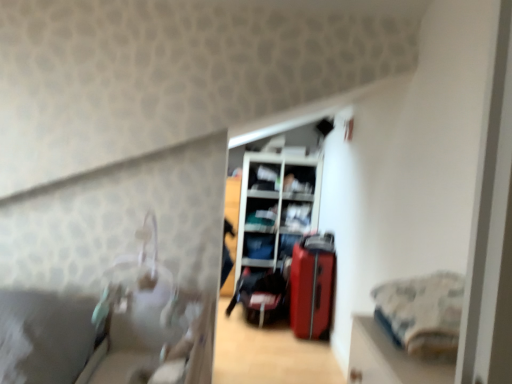
Question: Is matte white shelf at center, acting as the third shelf starting from the bottom, located outside matte white shelf at upper center, which is the 4th shelf in bottom-to-top order?

Choices:
 (A) no
 (B) yes

Answer: (B)

Question: Can you confirm if matte white shelf at center, marked as the 3th shelf in a top-to-bottom arrangement, is positioned to the right of matte white shelf at upper center, which is the 4th shelf in bottom-to-top order?

Choices:
 (A) no
 (B) yes

Answer: (A)

Question: Does matte white shelf at center, marked as the 3th shelf in a top-to-bottom arrangement, have a lesser width compared to matte white shelf at upper center, which is the 4th shelf in bottom-to-top order?

Choices:
 (A) no
 (B) yes

Answer: (A)

Question: Can you confirm if matte white shelf at center, acting as the third shelf starting from the bottom, is taller than matte white shelf at upper center, which is the 2th shelf in top-to-bottom order?

Choices:
 (A) yes
 (B) no

Answer: (B)

Question: Is the depth of matte white shelf at center, marked as the 3th shelf in a top-to-bottom arrangement, greater than that of matte white shelf at upper center, which is the 2th shelf in top-to-bottom order?

Choices:
 (A) yes
 (B) no

Answer: (A)

Question: Is shiny red suitcase at center, positioned as the 2th luggage in left-to-right order, in front of or behind matte black shelf at center, the first shelf ordered from the bottom, in the image?

Choices:
 (A) behind
 (B) front

Answer: (B)

Question: Is shiny red suitcase at center, positioned as the 2th luggage in left-to-right order, taller or shorter than matte black shelf at center, the first shelf ordered from the bottom?

Choices:
 (A) short
 (B) tall

Answer: (B)

Question: Considering the positions of shiny red suitcase at center, positioned as the 2th luggage in left-to-right order, and matte black shelf at center, arranged as the fifth shelf when viewed from the top, in the image, is shiny red suitcase at center, positioned as the 2th luggage in left-to-right order, wider or thinner than matte black shelf at center, arranged as the fifth shelf when viewed from the top,?

Choices:
 (A) thin
 (B) wide

Answer: (B)

Question: Would you say shiny red suitcase at center, arranged as the 1th luggage when viewed from the right, is to the left or to the right of matte black shelf at center, arranged as the fifth shelf when viewed from the top, in the picture?

Choices:
 (A) right
 (B) left

Answer: (A)

Question: Does point (274, 188) appear closer or farther from the camera than point (250, 243)?

Choices:
 (A) farther
 (B) closer

Answer: (B)

Question: Looking at their shapes, would you say matte white shelf at center, which is counted as the 1th shelf, starting from the top, is wider or thinner than matte black shelf at center, arranged as the fifth shelf when viewed from the top?

Choices:
 (A) wide
 (B) thin

Answer: (A)

Question: Is matte white shelf at center, which is counted as the 1th shelf, starting from the top, inside or outside of matte black shelf at center, arranged as the fifth shelf when viewed from the top?

Choices:
 (A) outside
 (B) inside

Answer: (A)

Question: From the image's perspective, relative to matte black shelf at center, the first shelf ordered from the bottom, is matte white shelf at center, the fifth shelf ordered from the bottom, above or below?

Choices:
 (A) below
 (B) above

Answer: (B)

Question: Is matte white shelf at upper center, which is the 4th shelf in bottom-to-top order, inside the boundaries of matte white shelf at center, acting as the third shelf starting from the bottom, or outside?

Choices:
 (A) outside
 (B) inside

Answer: (A)

Question: From their relative heights in the image, would you say matte white shelf at upper center, which is the 2th shelf in top-to-bottom order, is taller or shorter than matte white shelf at center, marked as the 3th shelf in a top-to-bottom arrangement?

Choices:
 (A) short
 (B) tall

Answer: (B)